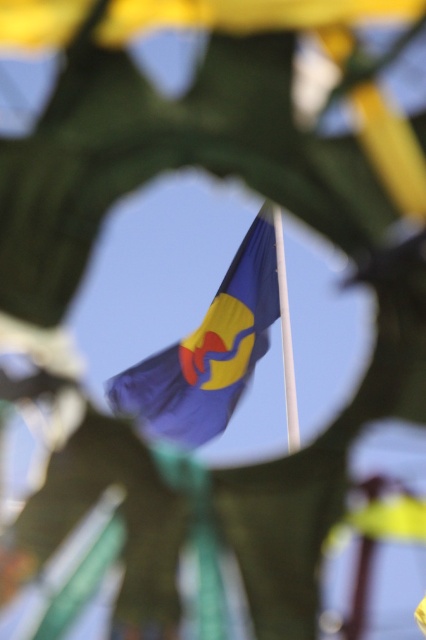
You are a painter standing 3 meters away from the flagpole. You want to paint the flag and the pole in the scene. If your canvas can only capture objects within a 2.5 meter range, will both the blue fabric flag at center and the white smooth pole at center fit on your canvas?

The blue fabric flag at center and white smooth pole at center are 2.65 meters apart. Since your canvas can only capture objects within a 2.5 meter range, they will not both fit on the canvas.